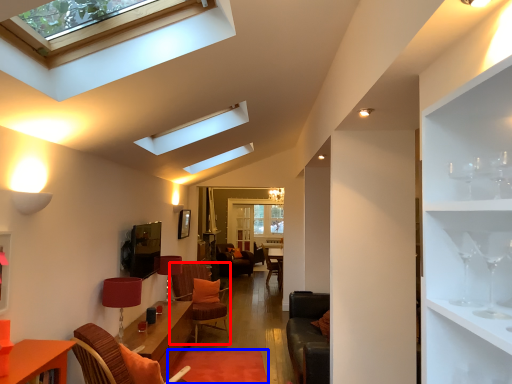
Question: Among these objects, which one is nearest to the camera, swivel chair (highlighted by a red box) or plain (highlighted by a blue box)?

Choices:
 (A) swivel chair
 (B) plain

Answer: (B)